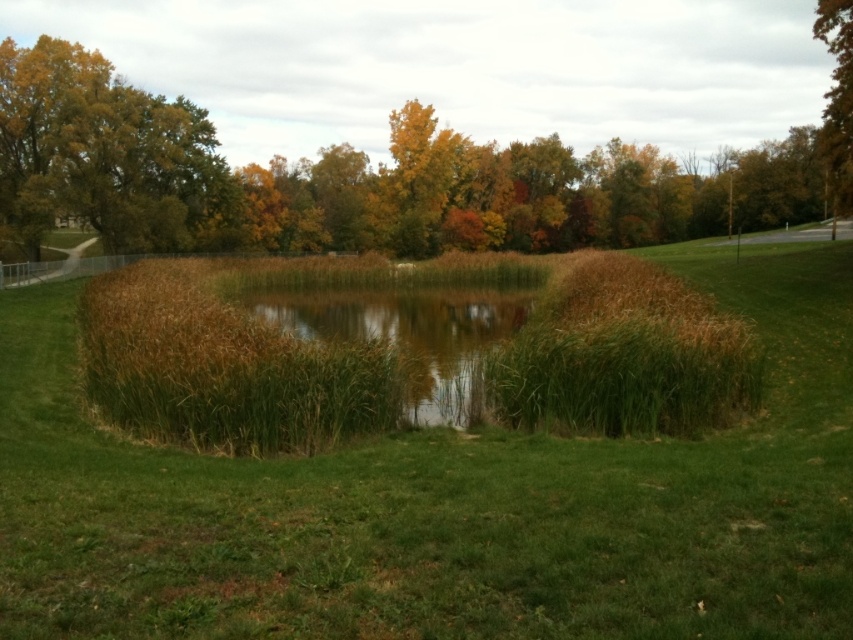
You are standing at the center of the image and want to find the green leafy tree at upper left. In which direction should you look to see it?

The green leafy tree at upper left is located at point (102, 154), which is to the upper left direction from your current position at the center of the image.

You are standing at the edge of the pond and want to take a photo of the green leafy tree at upper center. If your camera has a maximum zoom range of 50 meters, will you be able to capture the tree clearly in your photo?

The green leafy tree at upper center is 51.29 meters away from the camera. Since the camera can only zoom up to 50 meters, you won t be able to capture the tree clearly without moving closer.